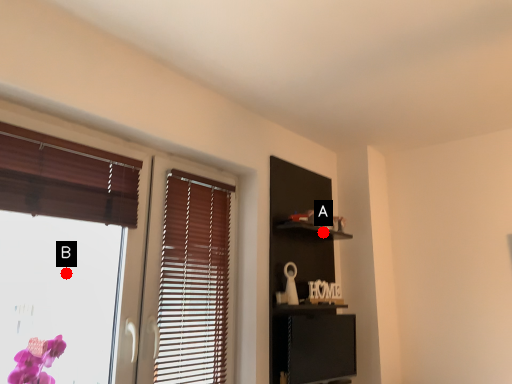
Question: Two points are circled on the image, labeled by A and B beside each circle. Which point is further to the camera?

Choices:
 (A) A is further
 (B) B is further

Answer: (A)